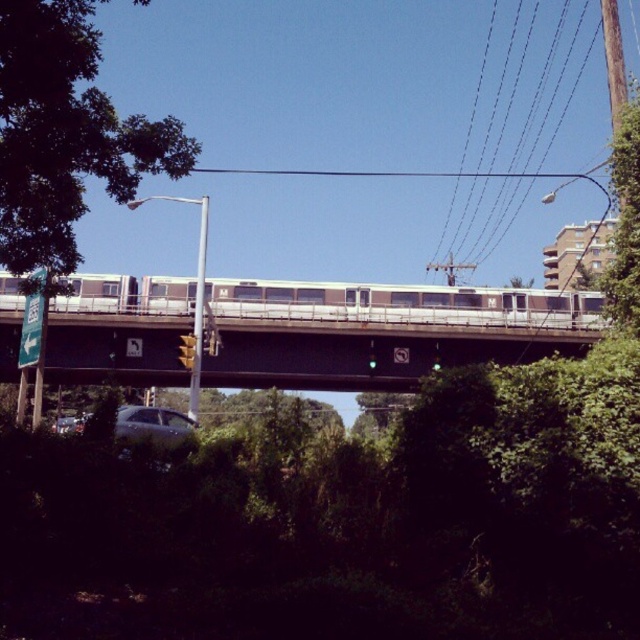
What is the 2D coordinate of the green leafy tree at upper left in the image?

The green leafy tree at upper left is located at the 2D coordinate point of (65, 132).

You are a passenger on the silver metallic train at center. Looking out the window, you notice the green leafy tree at upper left. Can you see the tree from your current position on the train?

The green leafy tree at upper left is positioned over the silver metallic train at center, so passengers on the silver metallic train at center would be able to see the tree above them through the window.